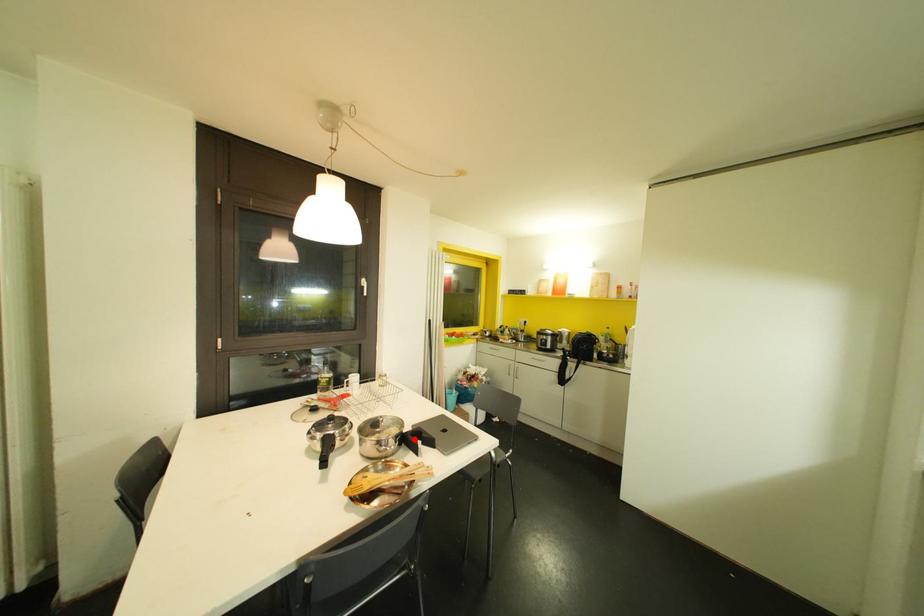
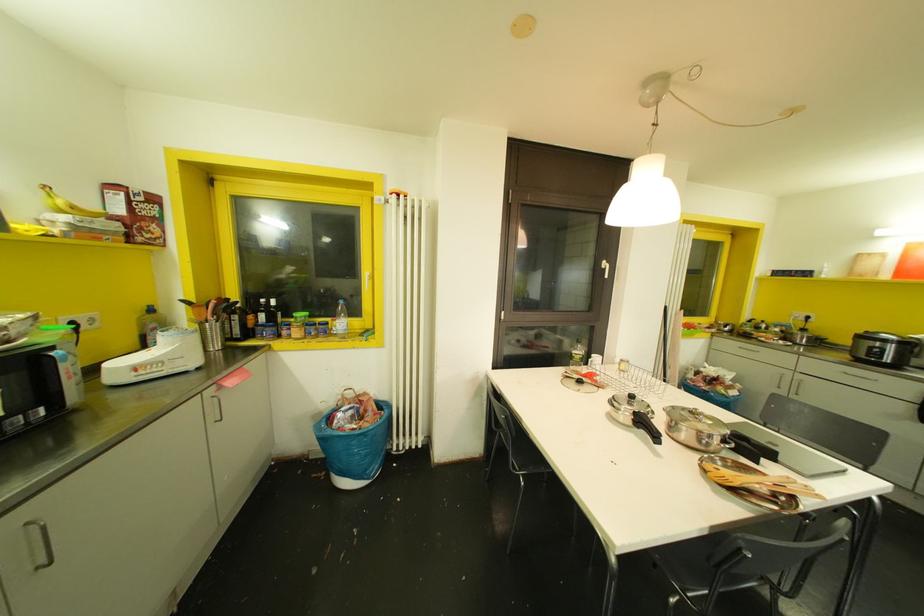
Find the pixel in the second image that matches the highlighted location in the first image.

(745, 444)